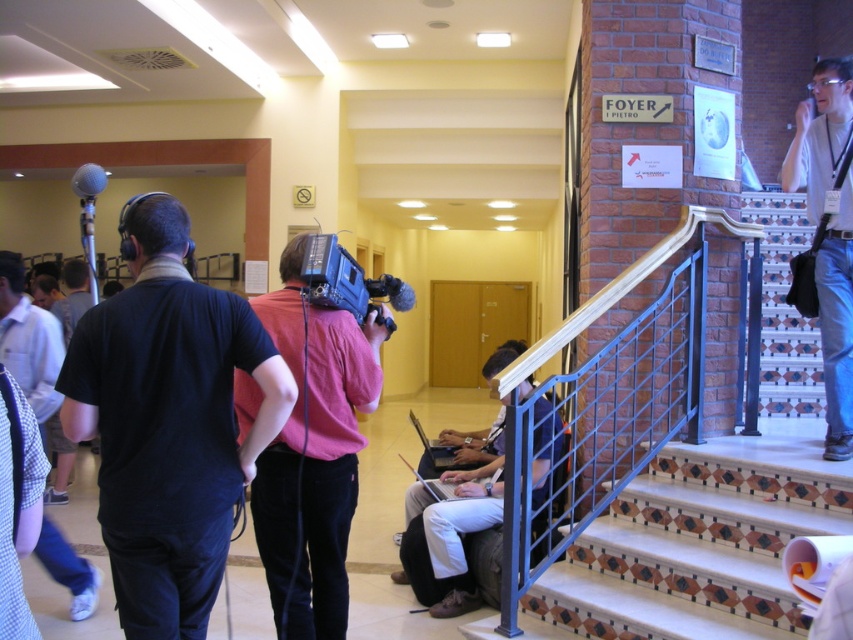
You are standing in the hallway and want to place a new decorative plant pot between the white tiled stairs at lower right and the matte black laptop at stairs. According to the scene description, which object should the plant pot be closer to?

The plant pot should be placed closer to the white tiled stairs at lower right because it is closer to the viewer than the matte black laptop at stairs.

You are standing in the hallway and want to go upstairs. There are white tiled stairs at lower right and blue jeans at right. Which direction should you go to reach the stairs?

The white tiled stairs at lower right are located below the blue jeans at right, so you should go towards the lower right direction to reach the stairs.

You are a delivery person carrying a large box that is 30 inches wide. You need to navigate through the hallway and reach the stairs. Can you safely pass between the blue jeans at right and the white tiled stairs at lower right without hitting the box against either?

The distance between the white tiled stairs at lower right and the blue jeans at right is 36.40 inches. Since your box is 30 inches wide, there is enough space to pass safely between them.